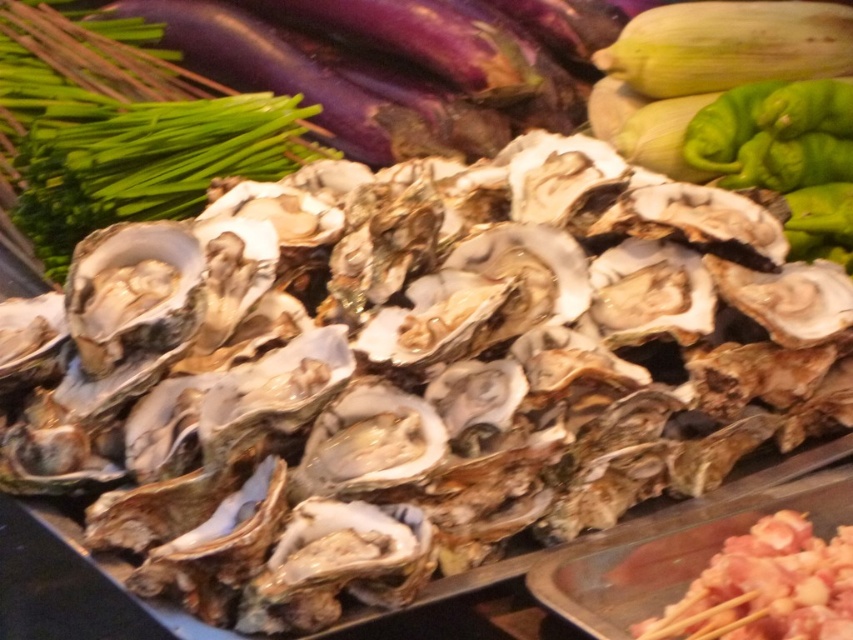
You are a chef preparing a dish and need to choose between the green leafy at upper left and the pink raw meat at bottom right. Which one has a larger size?

The green leafy at upper left is bigger than the pink raw meat at bottom right, so the green leafy at upper left has a larger size.

In the scene shown: You are a customer at the market stall looking at the seafood and vegetables. You see a point marked at coordinates (122, 129). What is located at that point?

The point at coordinates (122, 129) marks the location of green leafy at upper left.